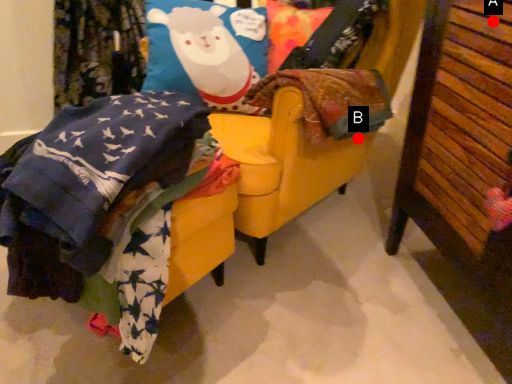
Question: Two points are circled on the image, labeled by A and B beside each circle. Which point is farther to the camera?

Choices:
 (A) A is further
 (B) B is further

Answer: (B)